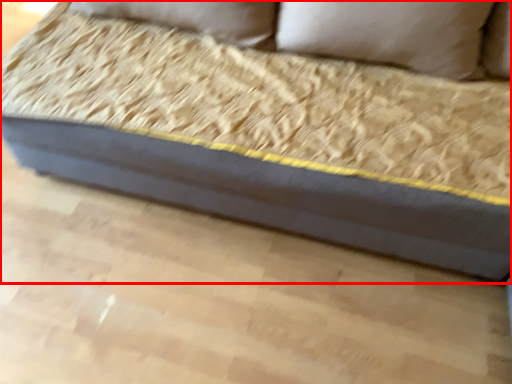
Question: Considering the relative positions of studio couch (annotated by the red box) and pillow in the image provided, where is studio couch (annotated by the red box) located with respect to the staircase?

Choices:
 (A) right
 (B) left

Answer: (B)